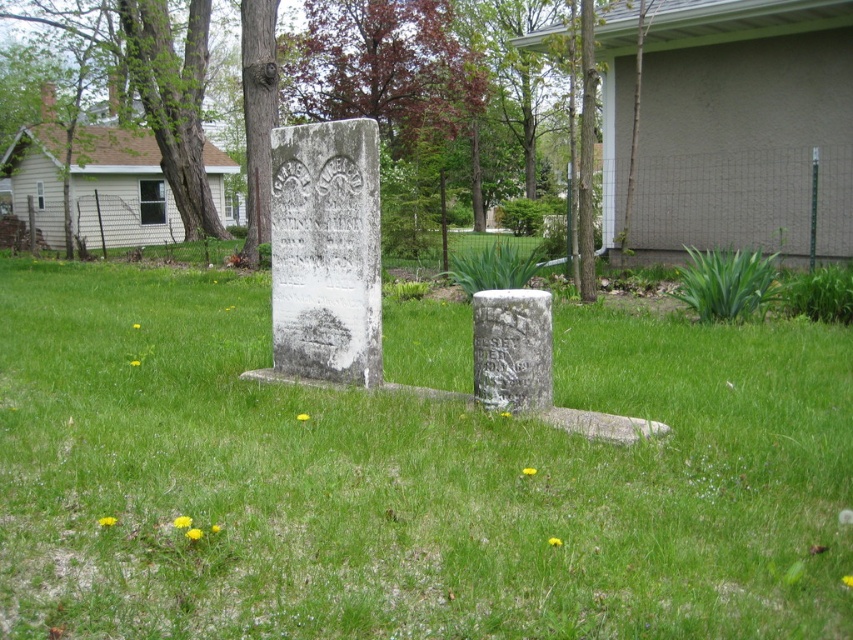
Who is positioned more to the right, green grass at center or green rough bark tree at upper left?

green grass at center is more to the right.

Is point (126, 560) positioned before point (167, 12)?

Yes, point (126, 560) is closer to viewer.

Which is behind, point (184, 604) or point (173, 124)?

The point (173, 124) is more distant.

Locate an element on the screen. The image size is (853, 640). green grass at center is located at coordinates (405, 477).

Which is in front, point (474, 470) or point (514, 310)?

Point (474, 470) is in front.

Does green grass at center appear on the right side of white stone gravestone at center?

Incorrect, green grass at center is not on the right side of white stone gravestone at center.

Between point (10, 445) and point (537, 349), which one is positioned behind?

The point (537, 349) is behind.

Where is `green grass at center`? The image size is (853, 640). green grass at center is located at coordinates (405, 477).

Does point (198, 115) lie behind point (485, 330)?

Yes, it is.

Does green rough bark tree at upper left appear over white stone gravestone at center?

Yes, green rough bark tree at upper left is above white stone gravestone at center.

Who is more distant from viewer, (151,28) or (502,346)?

Point (151,28)

The height and width of the screenshot is (640, 853). I want to click on green rough bark tree at upper left, so click(x=173, y=102).